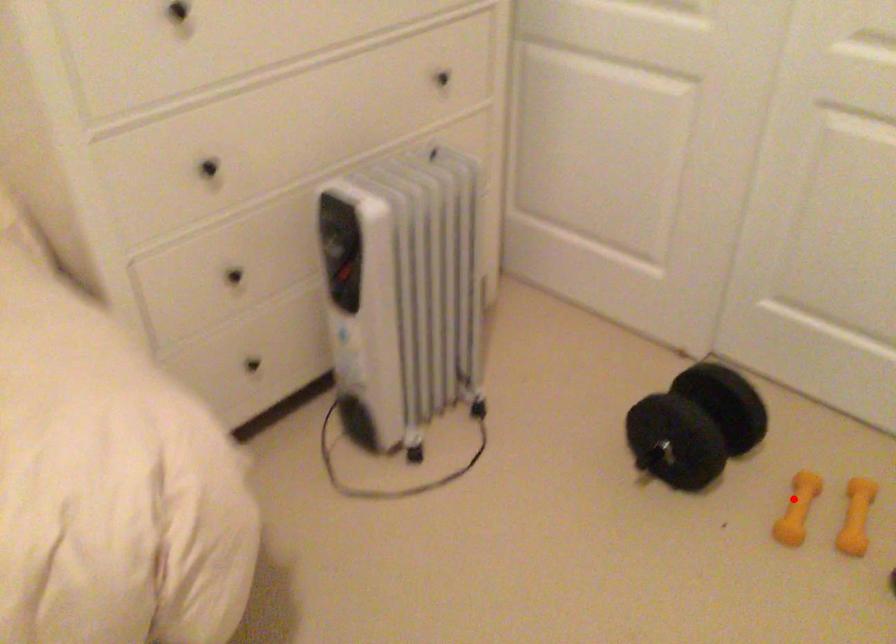
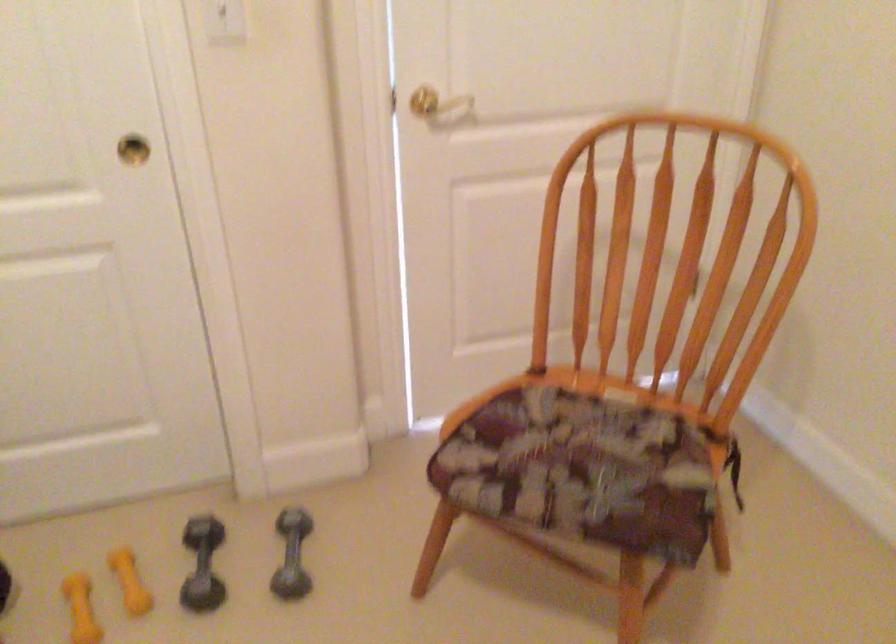
Locate, in the second image, the point that corresponds to the highlighted location in the first image.

(81, 609)